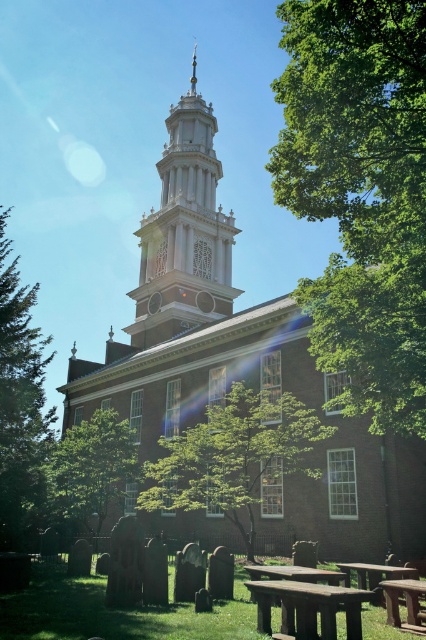
Question: Is green leafy tree at upper right to the right of green leafy tree at center from the viewer's perspective?

Choices:
 (A) yes
 (B) no

Answer: (A)

Question: Which point is closer to the camera?

Choices:
 (A) (215, 204)
 (B) (204, 291)
 (C) (359, 602)
 (D) (362, 209)

Answer: (C)

Question: Is brown brick church at center to the left of green leafy tree at center from the viewer's perspective?

Choices:
 (A) yes
 (B) no

Answer: (A)

Question: Considering the relative positions of brick stonework bell tower at center and wooden picnic table at lower center in the image provided, where is brick stonework bell tower at center located with respect to wooden picnic table at lower center?

Choices:
 (A) left
 (B) right

Answer: (A)

Question: Which object is closer to the camera taking this photo?

Choices:
 (A) green leafy tree at left
 (B) green leafy tree at center
 (C) green leafy tree at lower left
 (D) wooden picnic table at lower right

Answer: (D)

Question: Which of the following is the closest to the observer?

Choices:
 (A) green leafy tree at center
 (B) wooden picnic table at lower center
 (C) green leafy tree at lower left

Answer: (B)